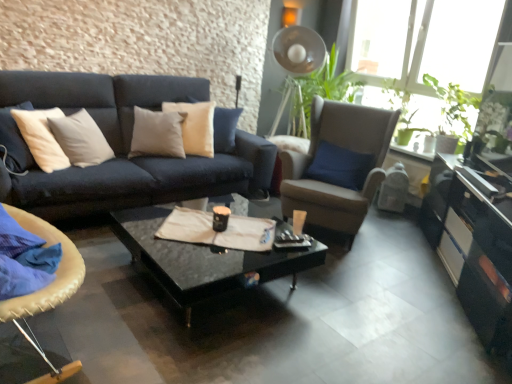
This screenshot has width=512, height=384. What do you see at coordinates (46, 289) in the screenshot? I see `leather cushioned chair at lower left, which is counted as the 2th chair, starting from the back` at bounding box center [46, 289].

Measure the distance between point (35, 345) and camera.

A distance of 5.49 feet exists between point (35, 345) and camera.

Describe the element at coordinates (472, 247) in the screenshot. Image resolution: width=512 pixels, height=384 pixels. I see `glossy black cabinet at lower right` at that location.

Image resolution: width=512 pixels, height=384 pixels. What are the coordinates of `green matte plant at upper right` in the screenshot? It's located at (401, 110).

Locate an element on the screen. matte black coffee cup at center is located at coordinates (220, 218).

Identify the location of leather cushioned chair at lower left, positioned as the second chair in right-to-left order. This screenshot has height=384, width=512. (46, 289).

From the image's perspective, would you say black glossy coffee table at center is positioned over green matte plant at upper right?

Incorrect, from the image's perspective, black glossy coffee table at center is lower than green matte plant at upper right.

Locate an element on the screen. The image size is (512, 384). coffee table lying on the left of green matte plant at upper right is located at coordinates (202, 260).

From the picture: Can you tell me how much black glossy coffee table at center and green matte plant at upper right differ in facing direction?

The angle between the facing direction of black glossy coffee table at center and the facing direction of green matte plant at upper right is 2.8 degrees.

Consider the image. From a real-world perspective, is black glossy coffee table at center located higher than green matte plant at upper right?

No, from a real-world perspective, black glossy coffee table at center is not over green matte plant at upper right

From a real-world perspective, is leather cushioned chair at lower left, which is the first chair from left to right, on top of glossy black cabinet at lower right?

Correct, in the physical world, leather cushioned chair at lower left, which is the first chair from left to right, is higher than glossy black cabinet at lower right.

Would you say glossy black cabinet at lower right is part of leather cushioned chair at lower left, which is the first chair from left to right,'s contents?

No, leather cushioned chair at lower left, which is the first chair from left to right, does not contain glossy black cabinet at lower right.

Find the location of a particular element. This screenshot has width=512, height=384. chair that is the 2nd one when counting leftward from the glossy black cabinet at lower right is located at coordinates (46, 289).

Relative to matte black coffee cup at center, is green matte plant at upper right in front or behind?

green matte plant at upper right is positioned farther from the viewer than matte black coffee cup at center.

Is the surface of green matte plant at upper right in direct contact with matte black coffee cup at center?

green matte plant at upper right and matte black coffee cup at center are clearly separated.

Is matte black coffee cup at center at the back of green matte plant at upper right?

green matte plant at upper right is not turned away from matte black coffee cup at center.

Which is in front, leather cushioned chair at lower left, which is the first chair from left to right, or black glossy coffee table at center?

leather cushioned chair at lower left, which is the first chair from left to right, is more forward.

How many degrees apart are the facing directions of leather cushioned chair at lower left, which is the first chair from left to right, and black glossy coffee table at center?

101 degrees separate the facing orientations of leather cushioned chair at lower left, which is the first chair from left to right, and black glossy coffee table at center.

Does point (19, 317) come farther from viewer compared to point (183, 300)?

No.

The width and height of the screenshot is (512, 384). Find the location of `coffee table that appears behind the leather cushioned chair at lower left, the 1th chair in the front-to-back sequence`. coffee table that appears behind the leather cushioned chair at lower left, the 1th chair in the front-to-back sequence is located at coordinates (202, 260).

Which object is wider, matte black coffee cup at center or green matte plant at upper right?

green matte plant at upper right is wider.

Considering the sizes of objects matte black coffee cup at center and green matte plant at upper right in the image provided, who is bigger, matte black coffee cup at center or green matte plant at upper right?

With larger size is green matte plant at upper right.

In the scene shown: From a real-world perspective, who is located lower, matte black coffee cup at center or green matte plant at upper right?

matte black coffee cup at center is physically lower.

Does glossy black cabinet at lower right appear on the right side of matte black coffee cup at center?

Indeed, glossy black cabinet at lower right is positioned on the right side of matte black coffee cup at center.

From a real-world perspective, is glossy black cabinet at lower right on top of matte black coffee cup at center?

Actually, glossy black cabinet at lower right is physically below matte black coffee cup at center in the real world.

How different are the orientations of glossy black cabinet at lower right and matte black coffee cup at center in degrees?

They differ by 90.5 degrees in their facing directions.

From the image's perspective, is glossy black cabinet at lower right on matte black coffee cup at center?

No, from the image's perspective, glossy black cabinet at lower right is not above matte black coffee cup at center.

Would you say suede-like beige armchair at center-right, which appears as the 1th chair when viewed from the back, is outside green matte plant at upper right?

Yes, suede-like beige armchair at center-right, which appears as the 1th chair when viewed from the back, is not within green matte plant at upper right.

Considering the positions of point (358, 122) and point (403, 101), is point (358, 122) closer or farther from the camera than point (403, 101)?

Point (358, 122) is closer to the camera than point (403, 101).

Which object is more forward, suede-like beige armchair at center-right, the second chair from the left, or green matte plant at upper right?

suede-like beige armchair at center-right, the second chair from the left, is in front.

Considering the sizes of suede-like beige armchair at center-right, the 1th chair viewed from the right, and green matte plant at upper right in the image, is suede-like beige armchair at center-right, the 1th chair viewed from the right, taller or shorter than green matte plant at upper right?

Considering their sizes, suede-like beige armchair at center-right, the 1th chair viewed from the right, has more height than green matte plant at upper right.

Identify the location of coffee table below the green matte plant at upper right (from a real-world perspective). The image size is (512, 384). (202, 260).

Identify the location of the 2nd chair to the left when counting from the glossy black cabinet at lower right. This screenshot has width=512, height=384. pyautogui.click(x=46, y=289).

In the scene shown: Based on their spatial positions, is suede-like beige armchair at center-right, the second chair from the left, or leather cushioned chair at lower left, which is counted as the 2th chair, starting from the back, closer to glossy black cabinet at lower right?

suede-like beige armchair at center-right, the second chair from the left, is positioned closer to the anchor glossy black cabinet at lower right.

Estimate the real-world distances between objects in this image. Which object is further from glossy black cabinet at lower right, matte black coffee cup at center or suede-like beige armchair at center-right, the second chair from the left?

matte black coffee cup at center lies further to glossy black cabinet at lower right than the other object.

Based on their spatial positions, is suede-like beige armchair at center-right, the second chair from the front, or glossy black cabinet at lower right closer to black glossy coffee table at center?

Based on the image, suede-like beige armchair at center-right, the second chair from the front, appears to be nearer to black glossy coffee table at center.

Estimate the real-world distances between objects in this image. Which object is closer to leather cushioned chair at lower left, which is counted as the 2th chair, starting from the back, matte black coffee cup at center or glossy black cabinet at lower right?

matte black coffee cup at center.

Based on their spatial positions, is leather cushioned chair at lower left, the 1th chair in the front-to-back sequence, or black glossy coffee table at center further from glossy black cabinet at lower right?

Based on the image, leather cushioned chair at lower left, the 1th chair in the front-to-back sequence, appears to be further to glossy black cabinet at lower right.

Looking at the image, which one is located closer to leather cushioned chair at lower left, which is counted as the 2th chair, starting from the back, suede-like beige armchair at center-right, the second chair from the front, or black glossy coffee table at center?

black glossy coffee table at center is closer to leather cushioned chair at lower left, which is counted as the 2th chair, starting from the back.

Based on their spatial positions, is leather cushioned chair at lower left, positioned as the second chair in right-to-left order, or suede-like beige armchair at center-right, which appears as the 1th chair when viewed from the back, closer to matte black coffee cup at center?

leather cushioned chair at lower left, positioned as the second chair in right-to-left order.

When comparing their distances from glossy black cabinet at lower right, does green matte plant at upper right or black glossy coffee table at center seem further?

green matte plant at upper right is further to glossy black cabinet at lower right.

Where is `chair between matte black coffee cup at center and green matte plant at upper right in the horizontal direction`? This screenshot has width=512, height=384. chair between matte black coffee cup at center and green matte plant at upper right in the horizontal direction is located at coordinates (344, 147).

Image resolution: width=512 pixels, height=384 pixels. I want to click on coffee table positioned between leather cushioned chair at lower left, positioned as the second chair in right-to-left order, and green matte plant at upper right from near to far, so click(x=202, y=260).

Find the location of `chair between leather cushioned chair at lower left, which is the first chair from left to right, and glossy black cabinet at lower right`. chair between leather cushioned chair at lower left, which is the first chair from left to right, and glossy black cabinet at lower right is located at coordinates click(344, 147).

The image size is (512, 384). In order to click on coffee cup between leather cushioned chair at lower left, which is counted as the 2th chair, starting from the back, and green matte plant at upper right, along the z-axis in this screenshot , I will do `click(220, 218)`.